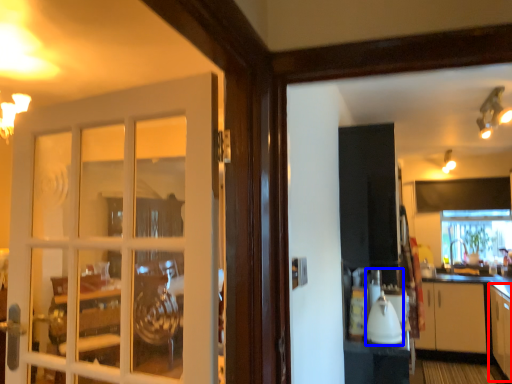
Question: Which object is closer to the camera taking this photo, cabinetry (highlighted by a red box) or appliance (highlighted by a blue box)?

Choices:
 (A) cabinetry
 (B) appliance

Answer: (B)